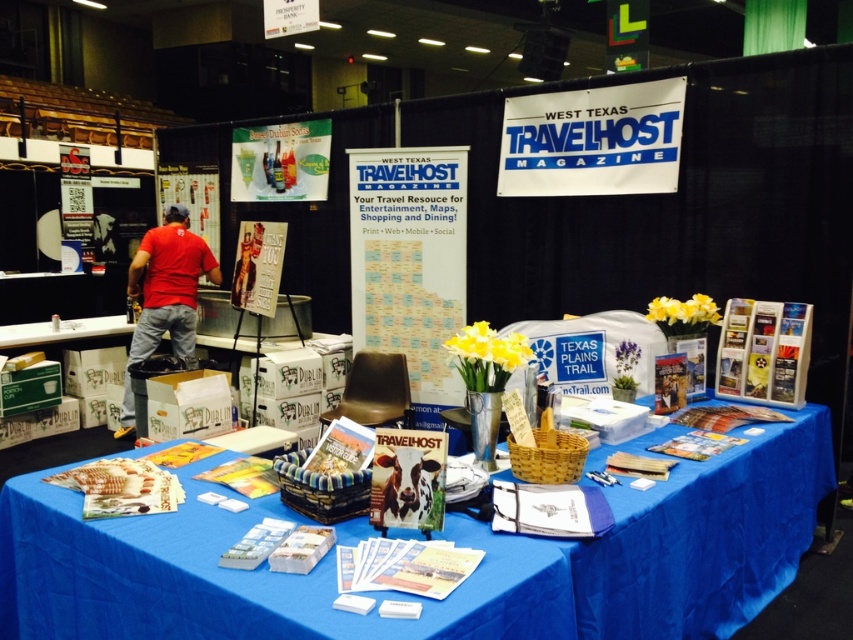
Question: Does blue fabric table at center lie in front of red cotton t-shirt at left?

Choices:
 (A) yes
 (B) no

Answer: (A)

Question: Which object appears farthest from the camera in this image?

Choices:
 (A) blue fabric table at center
 (B) red cotton t-shirt at left

Answer: (B)

Question: Is blue fabric table at center wider than red cotton t-shirt at left?

Choices:
 (A) no
 (B) yes

Answer: (B)

Question: Among these points, which one is farthest from the camera?

Choices:
 (A) (808, 468)
 (B) (128, 266)

Answer: (B)

Question: Is blue fabric table at center to the right of red cotton t-shirt at left from the viewer's perspective?

Choices:
 (A) yes
 (B) no

Answer: (A)